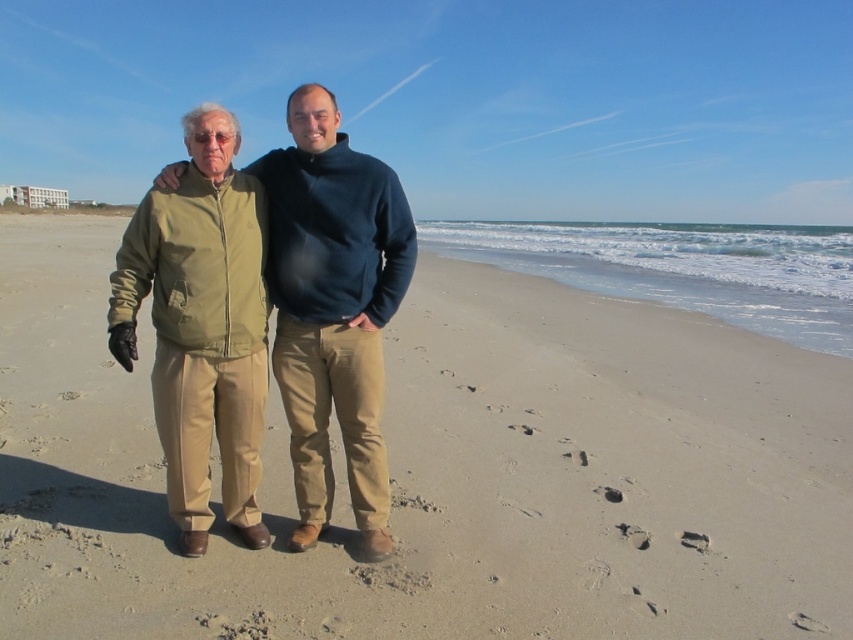
Question: Does light brown sand at center have a larger size compared to khaki cotton pants at center?

Choices:
 (A) no
 (B) yes

Answer: (B)

Question: Which point is farther to the camera?

Choices:
 (A) light brown sand at center
 (B) khaki cotton pants at center

Answer: (B)

Question: Which of the following is the closest to the observer?

Choices:
 (A) (792, 449)
 (B) (190, 182)

Answer: (B)

Question: Is light brown sand at center behind khaki cotton pants at center?

Choices:
 (A) no
 (B) yes

Answer: (A)

Question: Can you confirm if light brown sand at center is wider than khaki cotton pants at center?

Choices:
 (A) yes
 (B) no

Answer: (A)